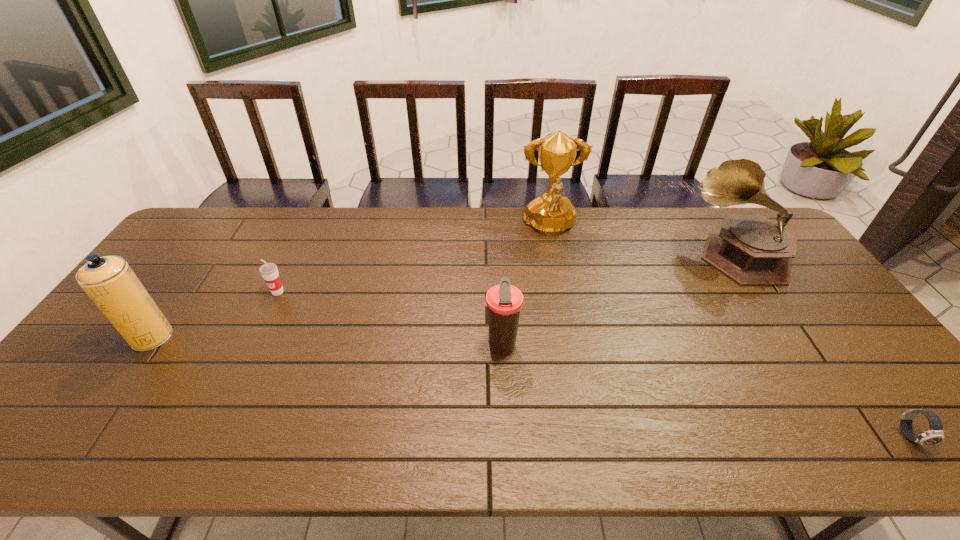
Locate an element on the screen. vacant space situated on the horn direction of the phonograph record is located at coordinates (587, 254).

Identify the location of free spot located 0.100m on the horn direction of the phonograph record. The image size is (960, 540). point(658,254).

This screenshot has height=540, width=960. In order to click on free space located on the horn direction of the phonograph record in this screenshot , I will do `click(627, 254)`.

Locate an element on the screen. vacant space located 0.360m on the right of the leftmost object is located at coordinates pos(304,337).

This screenshot has width=960, height=540. Find the location of `vacant space situated on the right of the fourth object from right to left`. vacant space situated on the right of the fourth object from right to left is located at coordinates (636, 346).

In order to click on vacant region located 0.110m on the side of the fifth tallest object with the logo in this screenshot , I will do `click(261, 326)`.

At what (x,y) coordinates should I click in order to perform the action: click on award that is at the far edge. Please return your answer as a coordinate pair (x, y). Looking at the image, I should click on (550, 214).

Locate an element on the screen. Image resolution: width=960 pixels, height=540 pixels. phonograph record at the far edge is located at coordinates tap(750, 249).

Locate an element on the screen. This screenshot has width=960, height=540. object at the near edge is located at coordinates (934, 435).

Image resolution: width=960 pixels, height=540 pixels. I want to click on object that is at the left edge, so click(109, 281).